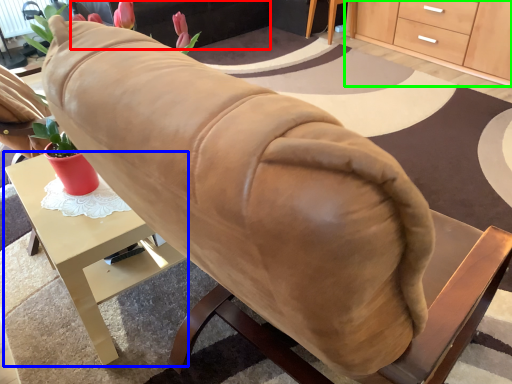
Question: Based on their relative distances, which object is nearer to couch (highlighted by a red box)? Choose from desk (highlighted by a blue box) and cabinetry (highlighted by a green box).

Choices:
 (A) desk
 (B) cabinetry

Answer: (B)